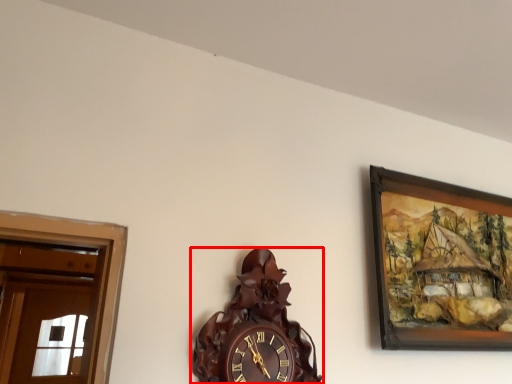
Question: Considering the relative positions of wall clock (annotated by the red box) and picture frame in the image provided, where is wall clock (annotated by the red box) located with respect to the staircase?

Choices:
 (A) right
 (B) left

Answer: (B)